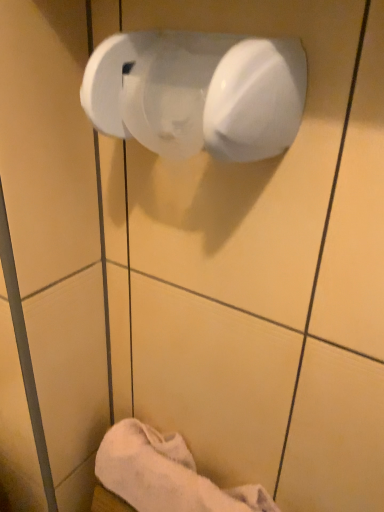
This screenshot has width=384, height=512. What do you see at coordinates (198, 93) in the screenshot?
I see `white glossy toilet paper at upper center` at bounding box center [198, 93].

Identify the location of white glossy toilet paper at upper center. This screenshot has height=512, width=384. (198, 93).

At what (x,y) coordinates should I click in order to perform the action: click on white fluffy towel at lower left. Please return your answer as a coordinate pair (x, y). The height and width of the screenshot is (512, 384). Looking at the image, I should click on (166, 474).

Describe the element at coordinates (166, 474) in the screenshot. The width and height of the screenshot is (384, 512). I see `white fluffy towel at lower left` at that location.

At what (x,y) coordinates should I click in order to perform the action: click on white glossy toilet paper at upper center. Please return your answer as a coordinate pair (x, y). Looking at the image, I should click on (198, 93).

Considering the relative positions of white fluffy towel at lower left and white glossy toilet paper at upper center in the image provided, is white fluffy towel at lower left to the right of white glossy toilet paper at upper center from the viewer's perspective?

In fact, white fluffy towel at lower left is to the left of white glossy toilet paper at upper center.

In the image, is white fluffy towel at lower left positioned in front of or behind white glossy toilet paper at upper center?

Visually, white fluffy towel at lower left is located behind white glossy toilet paper at upper center.

Which point is more distant from viewer, (x=108, y=442) or (x=110, y=68)?

Point (x=108, y=442)

From the image's perspective, which is below, white fluffy towel at lower left or white glossy toilet paper at upper center?

white fluffy towel at lower left.

Consider the image. From a real-world perspective, is white fluffy towel at lower left positioned over white glossy toilet paper at upper center based on gravity?

No, from a real-world perspective, white fluffy towel at lower left is not over white glossy toilet paper at upper center

Can you confirm if white fluffy towel at lower left is wider than white glossy toilet paper at upper center?

Yes.

Can you confirm if white fluffy towel at lower left is shorter than white glossy toilet paper at upper center?

No.

Looking at this image, in terms of size, does white fluffy towel at lower left appear bigger or smaller than white glossy toilet paper at upper center?

In the image, white fluffy towel at lower left appears to be larger than white glossy toilet paper at upper center.

Would you say white fluffy towel at lower left is inside or outside white glossy toilet paper at upper center?

white fluffy towel at lower left is not enclosed by white glossy toilet paper at upper center.

Is white fluffy towel at lower left far from white glossy toilet paper at upper center?

They are positioned close to each other.

Does white fluffy towel at lower left turn towards white glossy toilet paper at upper center?

No.

How many degrees apart are the facing directions of white fluffy towel at lower left and white glossy toilet paper at upper center?

There is a 90-degree angle between the facing directions of white fluffy towel at lower left and white glossy toilet paper at upper center.

How far apart are white fluffy towel at lower left and white glossy toilet paper at upper center?

19.76 inches.

You are a GUI agent. You are given a task and a screenshot of the screen. Output one action in this format:
    pyautogui.click(x=<x>, y=<y>)
    Task: Click on the towel beneath the white glossy toilet paper at upper center (from a real-world perspective)
    The image size is (384, 512).
    Given the screenshot: What is the action you would take?
    pyautogui.click(x=166, y=474)

Based on their positions, is white glossy toilet paper at upper center located to the left or right of white fluffy towel at lower left?

Clearly, white glossy toilet paper at upper center is on the right of white fluffy towel at lower left in the image.

Between white glossy toilet paper at upper center and white fluffy towel at lower left, which one is positioned in front?

white glossy toilet paper at upper center.

Is point (233, 155) more distant than point (140, 494)?

No, it is not.

From the image's perspective, is white glossy toilet paper at upper center positioned above or below white fluffy towel at lower left?

white glossy toilet paper at upper center is above white fluffy towel at lower left.

From a real-world perspective, which is physically below, white glossy toilet paper at upper center or white fluffy towel at lower left?

white fluffy towel at lower left, from a real-world perspective.

Which object is wider, white glossy toilet paper at upper center or white fluffy towel at lower left?

Wider between the two is white fluffy towel at lower left.

Can you confirm if white glossy toilet paper at upper center is shorter than white fluffy towel at lower left?

Correct, white glossy toilet paper at upper center is not as tall as white fluffy towel at lower left.

Can you confirm if white glossy toilet paper at upper center is bigger than white fluffy towel at lower left?

No.

Is white glossy toilet paper at upper center inside or outside of white fluffy towel at lower left?

white glossy toilet paper at upper center is spatially situated outside white fluffy towel at lower left.

Is white glossy toilet paper at upper center next to white fluffy towel at lower left?

white glossy toilet paper at upper center and white fluffy towel at lower left are clearly separated.

Is white glossy toilet paper at upper center facing towards white fluffy towel at lower left?

No, white glossy toilet paper at upper center does not turn towards white fluffy towel at lower left.

Where is `towel directly beneath the white glossy toilet paper at upper center (from a real-world perspective)`? The height and width of the screenshot is (512, 384). towel directly beneath the white glossy toilet paper at upper center (from a real-world perspective) is located at coordinates tap(166, 474).

There is a white fluffy towel at lower left. What are the coordinates of `toilet paper above it (from a real-world perspective)` in the screenshot? It's located at (198, 93).

Image resolution: width=384 pixels, height=512 pixels. I want to click on towel on the left of white glossy toilet paper at upper center, so click(166, 474).